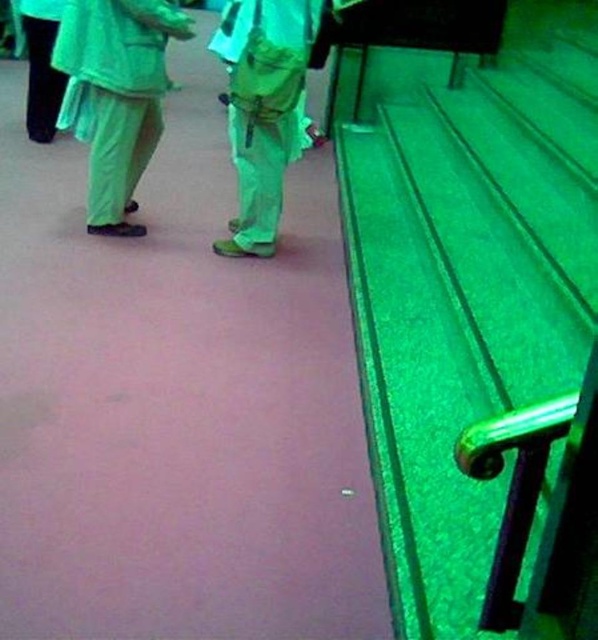
Question: Observing the image, what is the correct spatial positioning of green textured stair at right in reference to green fabric pants at left?

Choices:
 (A) above
 (B) below

Answer: (B)

Question: Is green textured stair at right thinner than black matte pants at left?

Choices:
 (A) yes
 (B) no

Answer: (B)

Question: Which of these objects is positioned closest to the green textured stair at right?

Choices:
 (A) matte green pants at center
 (B) black matte pants at left

Answer: (A)

Question: Considering the relative positions of green fabric pants at left and black matte pants at left in the image provided, where is green fabric pants at left located with respect to black matte pants at left?

Choices:
 (A) left
 (B) right

Answer: (B)

Question: Considering the real-world distances, which object is farthest from the green fabric pants at left?

Choices:
 (A) green textured stair at right
 (B) matte green pants at center
 (C) black matte pants at left

Answer: (A)

Question: Which point is closer to the camera?

Choices:
 (A) green textured stair at right
 (B) green fabric pants at left
 (C) black matte pants at left
 (D) matte green pants at center

Answer: (A)